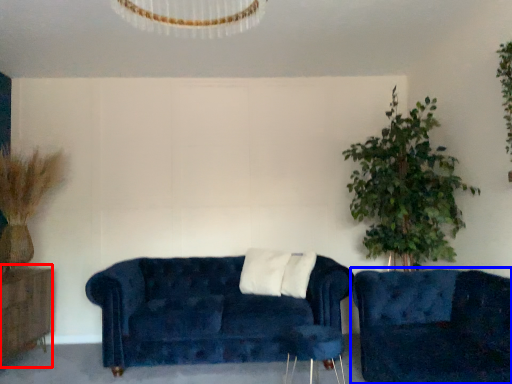
Question: Among these objects, which one is nearest to the camera, dresser (highlighted by a red box) or studio couch (highlighted by a blue box)?

Choices:
 (A) dresser
 (B) studio couch

Answer: (B)